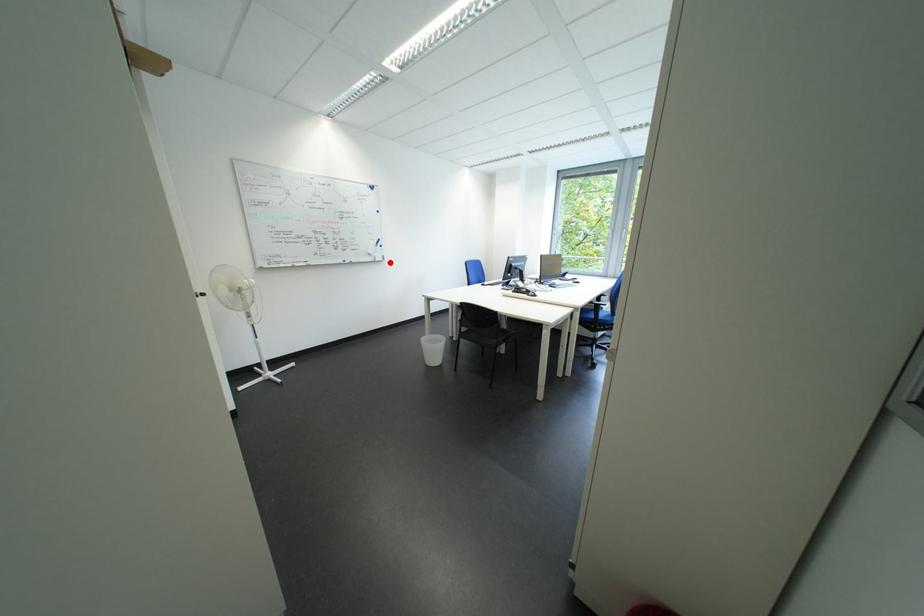
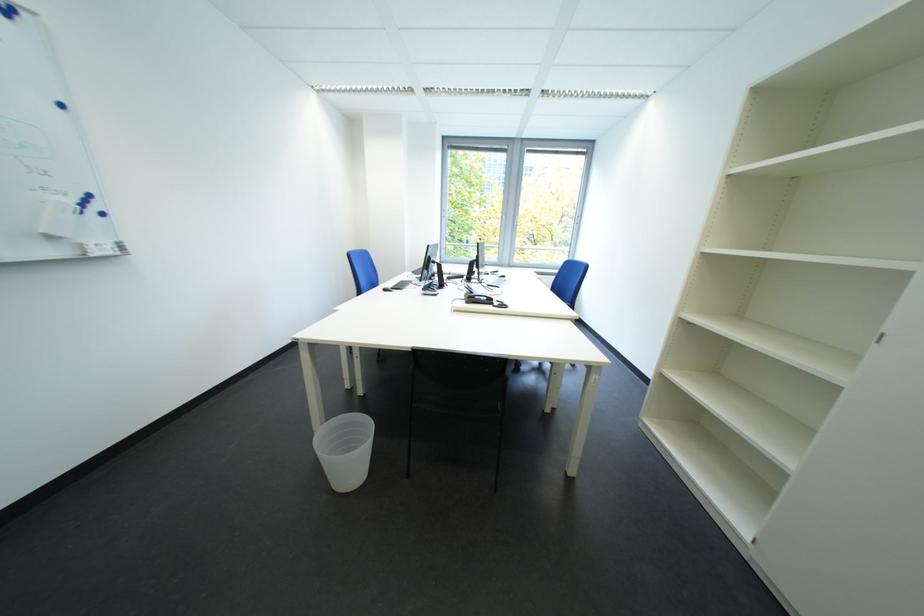
Find the pixel in the second image that matches the highlighted location in the first image.

(108, 256)